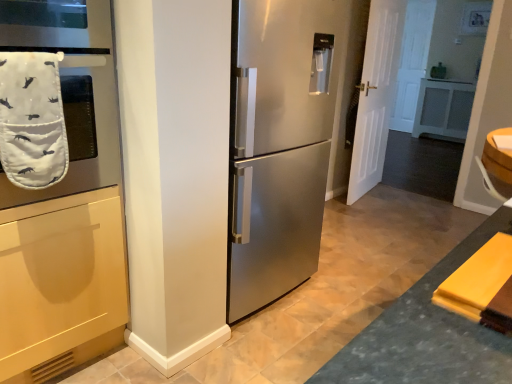
Question: Would you say stainless steel refrigerator at center is to the left or to the right of white matte door at right in the picture?

Choices:
 (A) right
 (B) left

Answer: (B)

Question: Is stainless steel refrigerator at center taller or shorter than white matte door at right?

Choices:
 (A) short
 (B) tall

Answer: (A)

Question: Which object is positioned closest to the white quilted oven mitt at left?

Choices:
 (A) white fabric oven mitt at left
 (B) stainless steel refrigerator at center
 (C) white matte door at right

Answer: (A)

Question: Considering the real-world distances, which object is farthest from the white quilted oven mitt at left?

Choices:
 (A) stainless steel refrigerator at center
 (B) white fabric oven mitt at left
 (C) white matte door at right

Answer: (C)